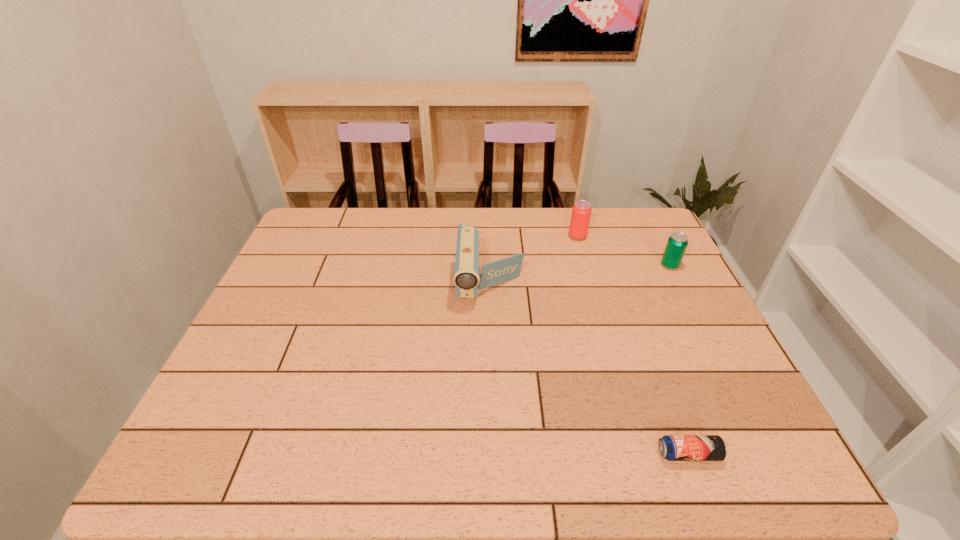
You are a GUI agent. You are given a task and a screenshot of the screen. Output one action in this format:
    pyautogui.click(x=<x>, y=<y>)
    Task: Click on the camcorder
    This screenshot has width=960, height=540.
    Given the screenshot: What is the action you would take?
    pyautogui.click(x=466, y=273)

Where is `the farthest beer can`? The height and width of the screenshot is (540, 960). the farthest beer can is located at coordinates (581, 212).

What are the coordinates of `the farthest object` in the screenshot? It's located at (581, 212).

At what (x,y) coordinates should I click in order to perform the action: click on the second nearest beer can. Please return your answer as a coordinate pair (x, y). Image resolution: width=960 pixels, height=540 pixels. Looking at the image, I should click on (677, 243).

Find the location of `the rightmost beer can`. the rightmost beer can is located at coordinates (677, 243).

The height and width of the screenshot is (540, 960). Identify the location of the shortest beer can. (671, 447).

I want to click on the second object from right to left, so click(671, 447).

Identify the location of free point located 0.270m on the side of the leftmost object with the flip-out screen. (492, 399).

Locate an element on the screen. This screenshot has height=540, width=960. free space located 0.340m on the front of the third object from right to left is located at coordinates (601, 319).

The width and height of the screenshot is (960, 540). Find the location of `vacant space located on the front of the second nearest beer can`. vacant space located on the front of the second nearest beer can is located at coordinates (725, 374).